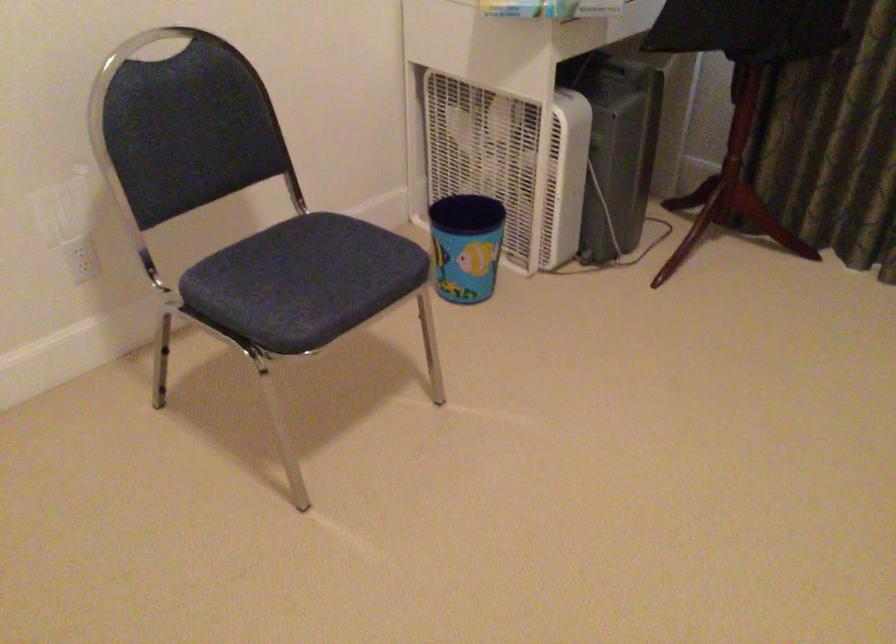
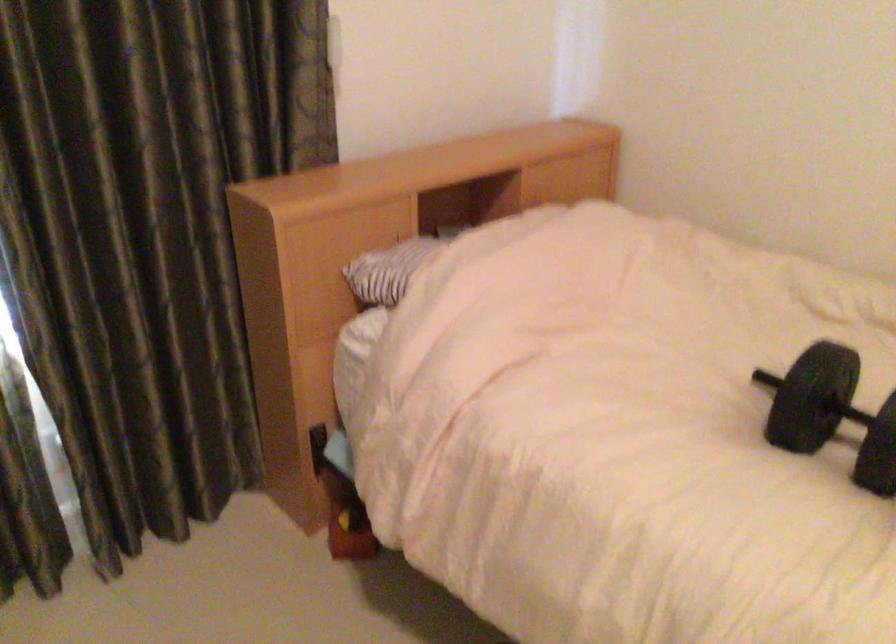
Based on the continuous images, in which direction is the camera rotating?

The camera's rotation is toward right-down.